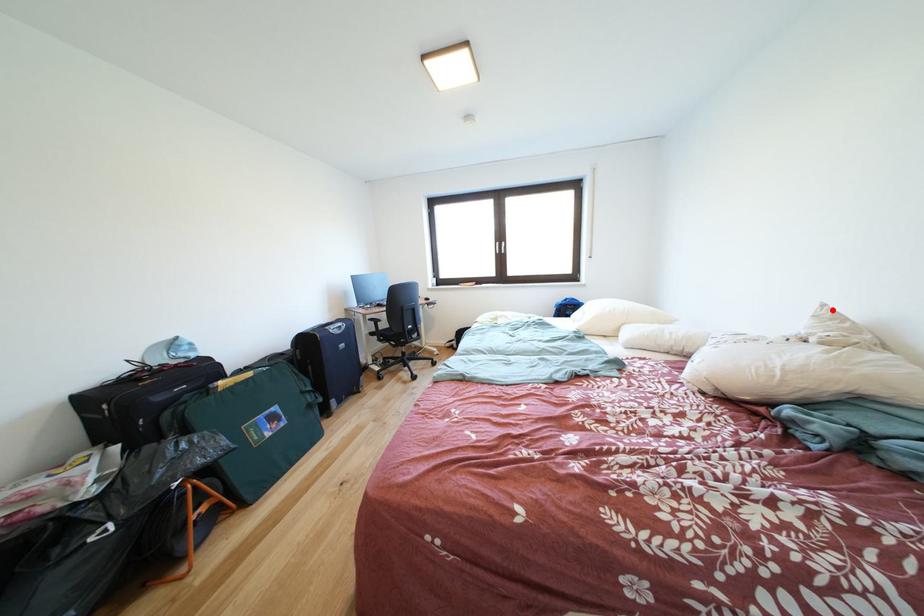
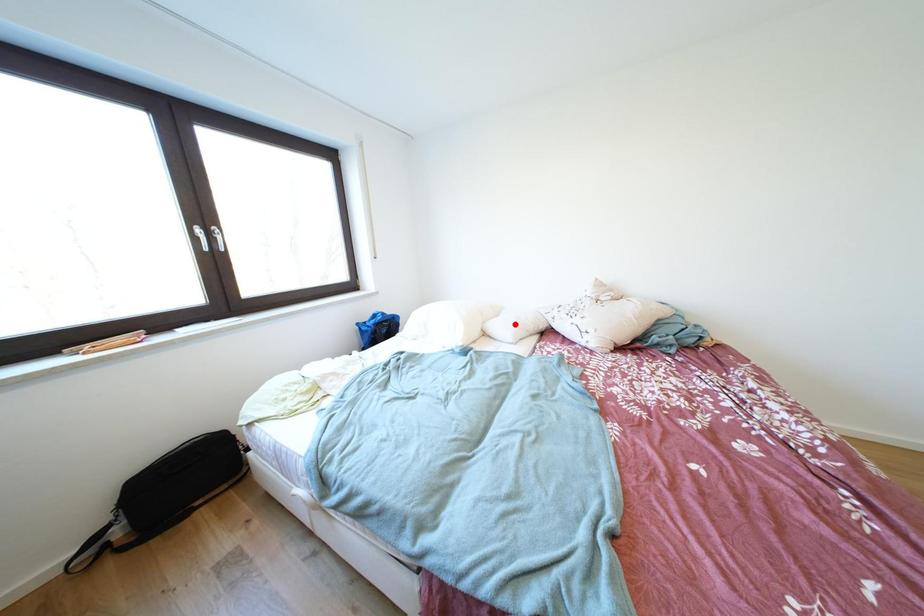
I am providing you with two images of the same scene from different viewpoints. A red point is marked on the first image and another point is marked on the second image. Do the highlighted points in image1 and image2 indicate the same real-world spot?

No